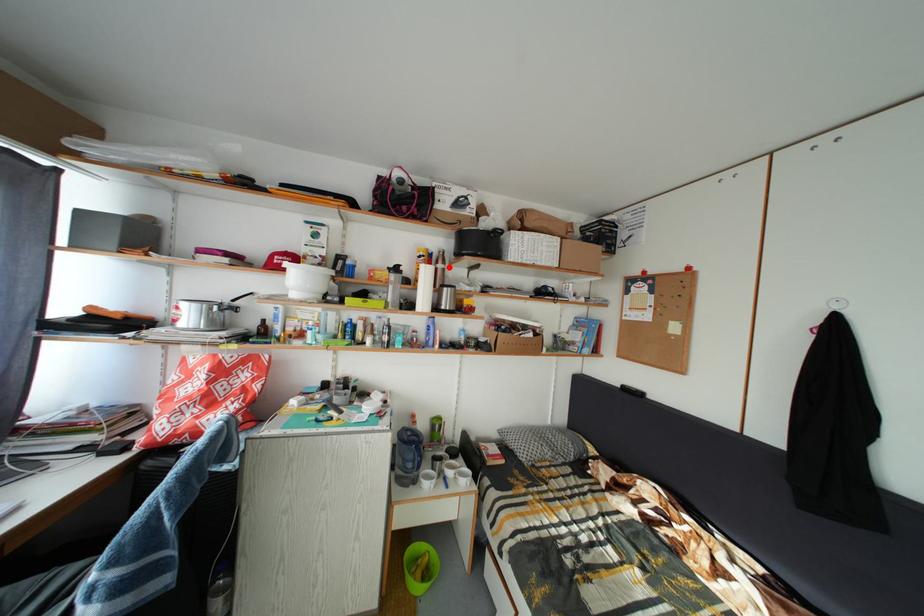
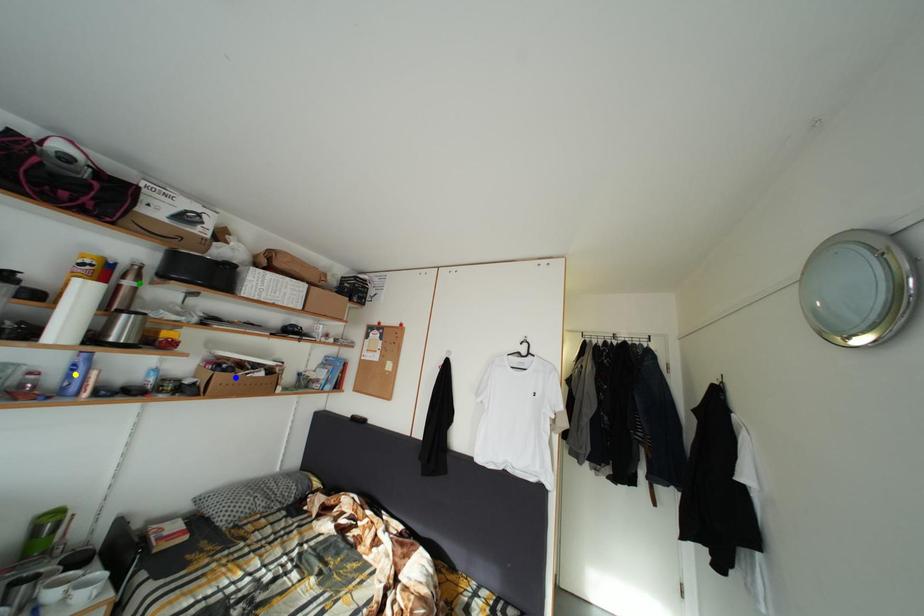
Question: I am providing you with two images of the same scene from different viewpoints. A red point is marked on the first image. You are given multiple points on the second image. Which point in image 2 is actually the same real-world point as the red point in image 1?

Choices:
 (A) yellow point
 (B) blue point
 (C) green point

Answer: (C)